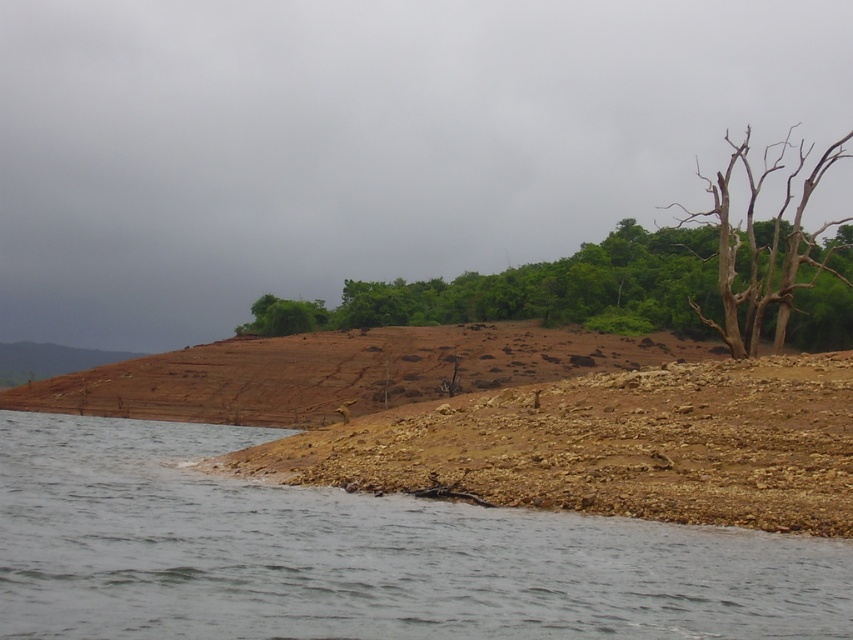
Which is more to the right, gray water at lower left or brown rough tree at center?

brown rough tree at center

At what (x,y) coordinates should I click in order to perform the action: click on gray water at lower left. Please return your answer as a coordinate pair (x, y). The width and height of the screenshot is (853, 640). Looking at the image, I should click on (358, 554).

Is brown rough tree at center taller than bare wood tree at upper right?

No.

At what (x,y) coordinates should I click in order to perform the action: click on brown rough tree at center. Please return your answer as a coordinate pair (x, y). Image resolution: width=853 pixels, height=640 pixels. Looking at the image, I should click on (537, 291).

Is point (598, 632) positioned in front of point (781, 220)?

Yes, it is.

At what (x,y) coordinates should I click in order to perform the action: click on gray water at lower left. Please return your answer as a coordinate pair (x, y). This screenshot has width=853, height=640. Looking at the image, I should click on (358, 554).